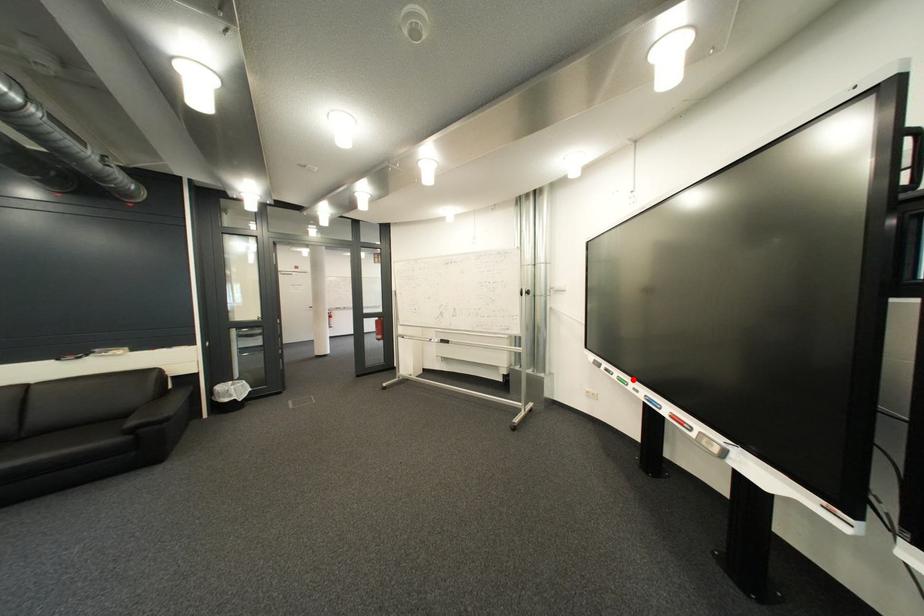
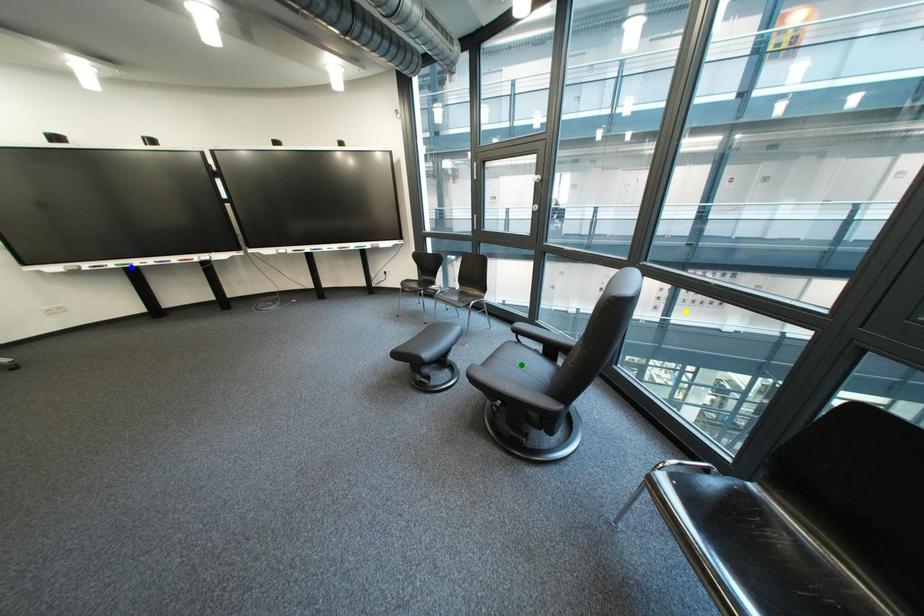
Question: I am providing you with two images of the same scene from different viewpoints. A red point is marked on the first image. You are given multiple points on the second image. Which point in image 2 is actually the same real-world point as the red point in image 1?

Choices:
 (A) green point
 (B) blue point
 (C) yellow point

Answer: (B)